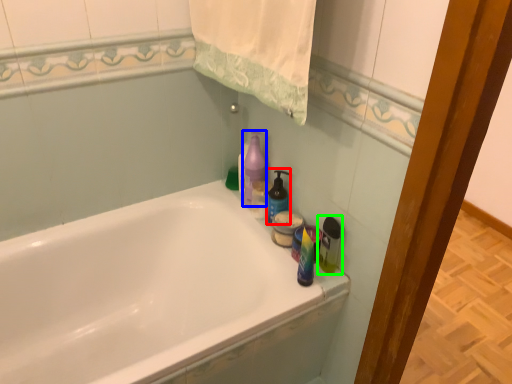
Question: Considering the real-world distances, which object is farthest from cleaning product (highlighted by a red box)? cleaning product (highlighted by a blue box) or cleaning product (highlighted by a green box)?

Choices:
 (A) cleaning product
 (B) cleaning product

Answer: (B)